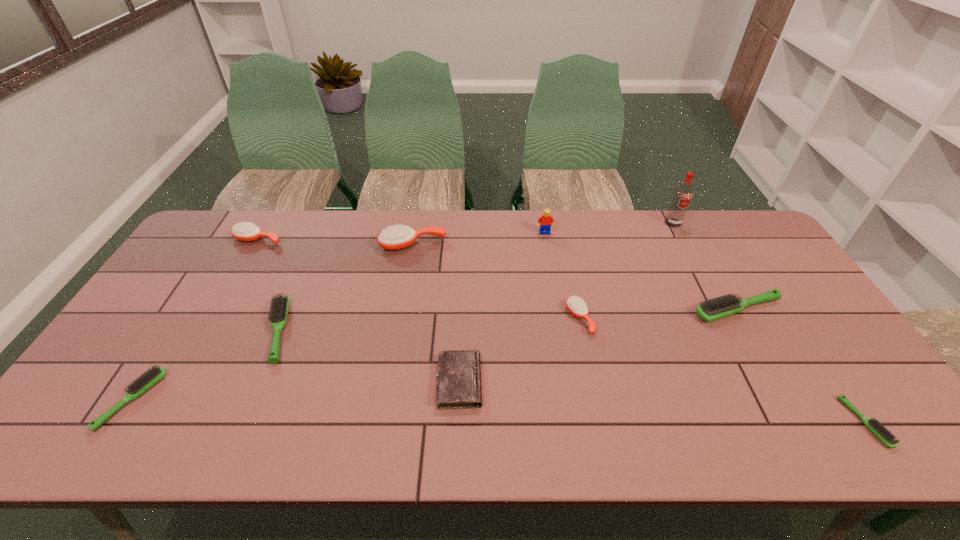
In order to click on free space located 0.340m on the right of the second biggest orange hairbrush in this screenshot , I will do `click(384, 240)`.

Find the location of a particular element. The width and height of the screenshot is (960, 540). vacant space situated on the back of the biggest light hairbrush is located at coordinates (704, 248).

At what (x,y) coordinates should I click in order to perform the action: click on free space located on the back of the second light hairbrush from left to right. Please return your answer as a coordinate pair (x, y). Looking at the image, I should click on (320, 231).

The width and height of the screenshot is (960, 540). Identify the location of free point located on the left of the smallest orange hairbrush. (496, 319).

Identify the location of free space located on the right of the second shortest hairbrush. This screenshot has width=960, height=540. (321, 400).

At what (x,y) coordinates should I click in order to perform the action: click on vacant area situated 0.380m on the left of the diary. Please return your answer as a coordinate pair (x, y). Looking at the image, I should click on (283, 382).

Image resolution: width=960 pixels, height=540 pixels. I want to click on vacant area located on the back of the smallest light hairbrush, so click(780, 295).

The width and height of the screenshot is (960, 540). In order to click on vodka that is positioned at the far edge in this screenshot , I will do `click(683, 193)`.

This screenshot has height=540, width=960. In order to click on Lego at the far edge in this screenshot , I will do `click(544, 222)`.

Locate an element on the screen. The image size is (960, 540). object located at the far left corner is located at coordinates (244, 231).